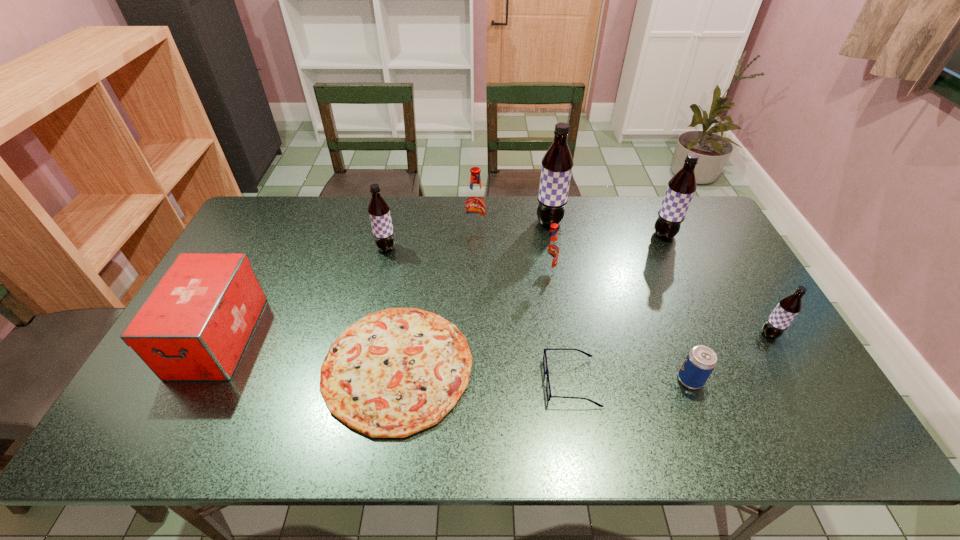
Find the location of a particular element. vacant area situated on the back of the second smallest brown root beer is located at coordinates (392, 223).

The width and height of the screenshot is (960, 540). I want to click on vacant region located 0.130m on the left of the second nearest root beer, so pos(498,271).

Locate an element on the screen. The width and height of the screenshot is (960, 540). vacant space located 0.060m on the back of the rightmost brown root beer is located at coordinates (756, 310).

Find the location of a particular element. This screenshot has width=960, height=540. free point located 0.110m on the handle side of the leftmost object is located at coordinates (172, 426).

Identify the location of free spot located 0.070m on the front of the beer can. (705, 418).

You are a GUI agent. You are given a task and a screenshot of the screen. Output one action in this format:
    pyautogui.click(x=<x>, y=<y>)
    Task: Click on the vacant space situated on the front-facing side of the spectacles
    Image resolution: width=960 pixels, height=540 pixels.
    Given the screenshot: What is the action you would take?
    pyautogui.click(x=513, y=382)

I want to click on free point located 0.340m on the front-facing side of the spectacles, so click(407, 382).

Identify the location of vacant space located 0.180m on the front-facing side of the spectacles. The height and width of the screenshot is (540, 960). (472, 382).

Image resolution: width=960 pixels, height=540 pixels. What are the coordinates of `free space located on the back of the pizza` in the screenshot? It's located at (420, 226).

Find the location of a particular element. object situated at the near edge is located at coordinates (395, 372).